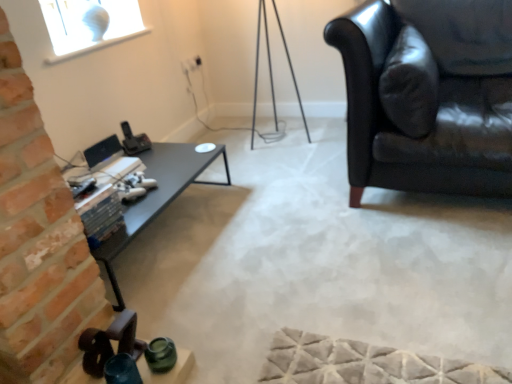
Where is `vacant space in front of black leather couch at right`? Image resolution: width=512 pixels, height=384 pixels. vacant space in front of black leather couch at right is located at coordinates (401, 288).